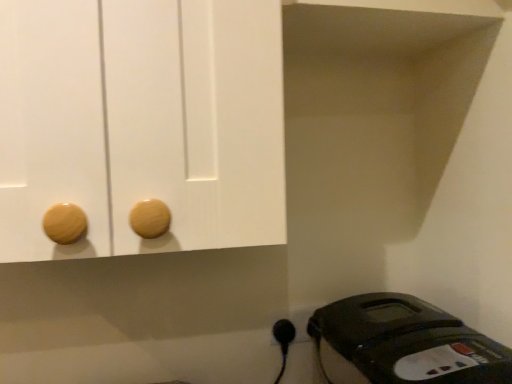
Question: From a real-world perspective, is black plastic plug at lower right beneath black plastic iron at lower right?

Choices:
 (A) no
 (B) yes

Answer: (A)

Question: Does black plastic plug at lower right contain black plastic iron at lower right?

Choices:
 (A) yes
 (B) no

Answer: (B)

Question: Can we say black plastic plug at lower right lies outside black plastic iron at lower right?

Choices:
 (A) yes
 (B) no

Answer: (A)

Question: Considering the relative sizes of black plastic plug at lower right and black plastic iron at lower right in the image provided, is black plastic plug at lower right bigger than black plastic iron at lower right?

Choices:
 (A) no
 (B) yes

Answer: (A)

Question: From the image's perspective, is black plastic plug at lower right below black plastic iron at lower right?

Choices:
 (A) yes
 (B) no

Answer: (B)

Question: Is black plastic plug at lower right oriented towards black plastic iron at lower right?

Choices:
 (A) yes
 (B) no

Answer: (B)

Question: Is black plastic outlet at lower right bigger than black plastic plug at lower right?

Choices:
 (A) yes
 (B) no

Answer: (A)

Question: Considering the relative sizes of black plastic outlet at lower right and black plastic plug at lower right in the image provided, is black plastic outlet at lower right taller than black plastic plug at lower right?

Choices:
 (A) no
 (B) yes

Answer: (B)

Question: Can you confirm if black plastic outlet at lower right is smaller than black plastic plug at lower right?

Choices:
 (A) no
 (B) yes

Answer: (A)

Question: From a real-world perspective, is black plastic outlet at lower right located higher than black plastic plug at lower right?

Choices:
 (A) no
 (B) yes

Answer: (B)

Question: Considering the relative sizes of black plastic outlet at lower right and black plastic plug at lower right in the image provided, is black plastic outlet at lower right shorter than black plastic plug at lower right?

Choices:
 (A) no
 (B) yes

Answer: (A)

Question: From a real-world perspective, is black plastic outlet at lower right physically below black plastic plug at lower right?

Choices:
 (A) no
 (B) yes

Answer: (A)

Question: Does black plastic outlet at lower right have a larger size compared to black plastic iron at lower right?

Choices:
 (A) no
 (B) yes

Answer: (A)